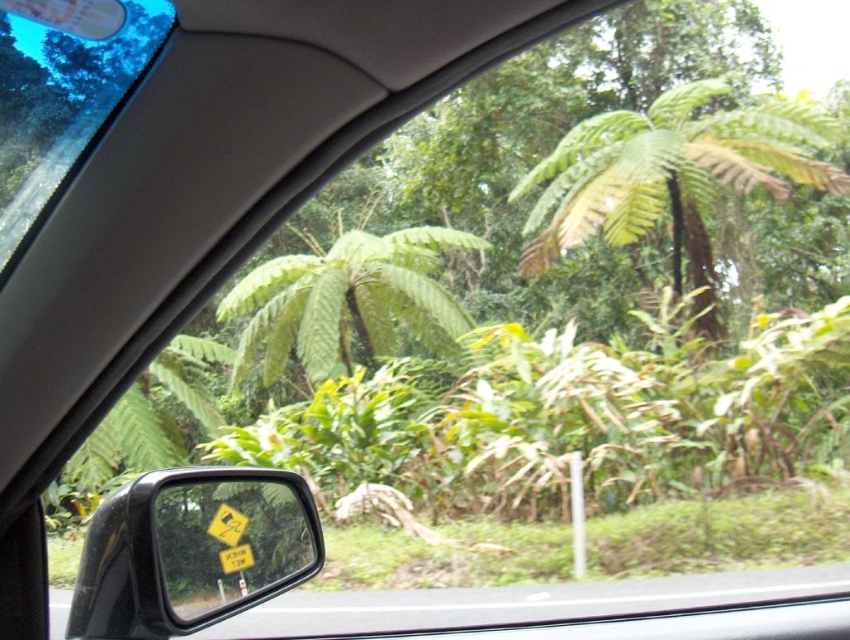
You are a passenger in the car and want to take a photo of the green leafy tree at center through the transparent glass car window at upper left. Will the tree be fully visible through the window?

The green leafy tree at center is positioned under the transparent glass car window at upper left, so the tree will be fully visible through the window.